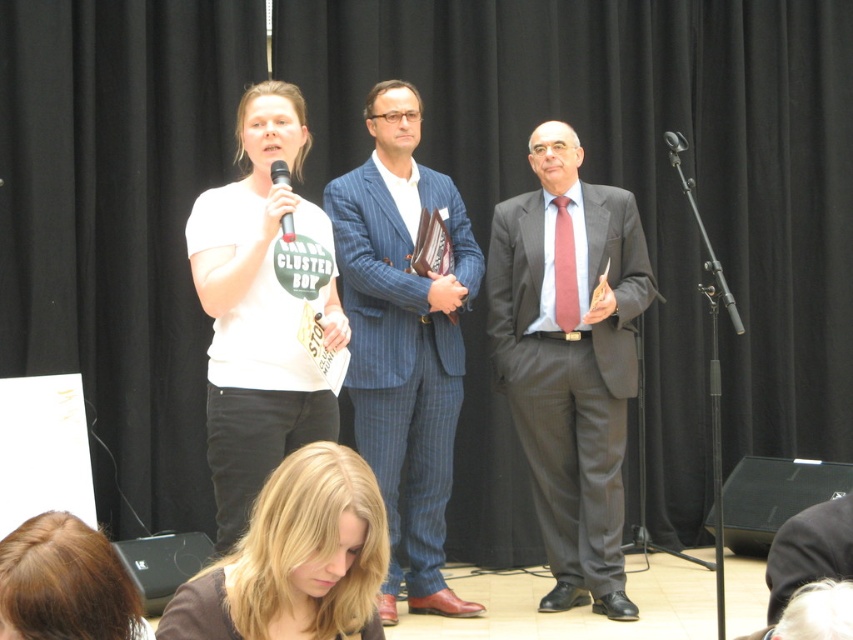
Is blonde hair at lower left bigger than dark gray wool suit at center?

No.

Does point (30, 518) lie behind point (817, 540)?

That is False.

Find the location of a particular element. blonde hair at lower left is located at coordinates (65, 582).

Is matte gray suit at center wider than blonde hair at lower left?

Yes.

Looking at this image, does matte gray suit at center appear under blonde hair at lower left?

No.

Is point (602, 573) less distant than point (57, 538)?

That is False.

Locate an element on the screen. The height and width of the screenshot is (640, 853). matte gray suit at center is located at coordinates (570, 364).

Where is `blonde hair at lower center`? This screenshot has width=853, height=640. blonde hair at lower center is located at coordinates (294, 560).

In the scene shown: Can you confirm if blonde hair at lower center is positioned above dark gray wool suit at center?

No, blonde hair at lower center is not above dark gray wool suit at center.

At what (x,y) coordinates should I click in order to perform the action: click on blonde hair at lower center. Please return your answer as a coordinate pair (x, y). Looking at the image, I should click on (294, 560).